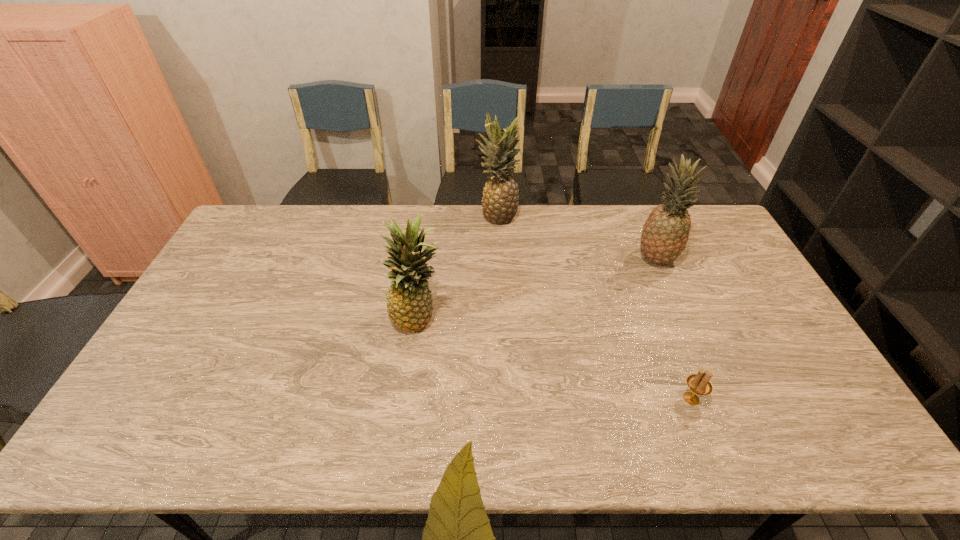
You are a GUI agent. You are given a task and a screenshot of the screen. Output one action in this format:
    pyautogui.click(x=<x>, y=<y>)
    Task: Click on the farthest pineapple
    
    Given the screenshot: What is the action you would take?
    pyautogui.click(x=500, y=200)

Image resolution: width=960 pixels, height=540 pixels. I want to click on the farthest object, so click(500, 200).

The width and height of the screenshot is (960, 540). I want to click on the second nearest pineapple, so click(x=665, y=233).

You are a GUI agent. You are given a task and a screenshot of the screen. Output one action in this format:
    pyautogui.click(x=<x>, y=<y>)
    Task: Click on the third nearest object
    The height and width of the screenshot is (540, 960).
    Given the screenshot: What is the action you would take?
    pyautogui.click(x=665, y=233)

Locate an element on the screen. the nearest pineapple is located at coordinates (409, 305).

This screenshot has width=960, height=540. Identify the location of the leftmost object. point(409,305).

What are the coordinates of `the shortest object` in the screenshot? It's located at (699, 383).

This screenshot has height=540, width=960. Find the location of `the nearest object`. the nearest object is located at coordinates (699, 383).

Image resolution: width=960 pixels, height=540 pixels. Identify the location of vacant space positioned on the right of the second object from left to right. (534, 217).

Locate an element on the screen. The height and width of the screenshot is (540, 960). vacant space located 0.100m on the front of the second farthest pineapple is located at coordinates (672, 296).